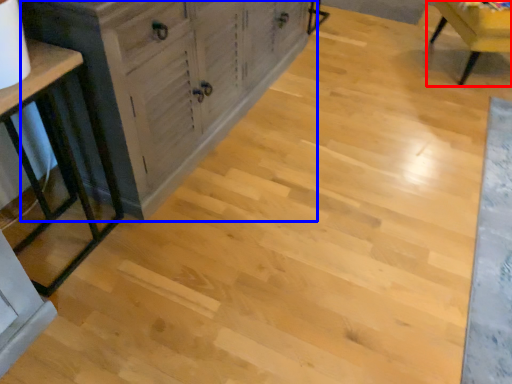
Question: Which of the following is the farthest to the observer, chair (highlighted by a red box) or cabinetry (highlighted by a blue box)?

Choices:
 (A) chair
 (B) cabinetry

Answer: (A)